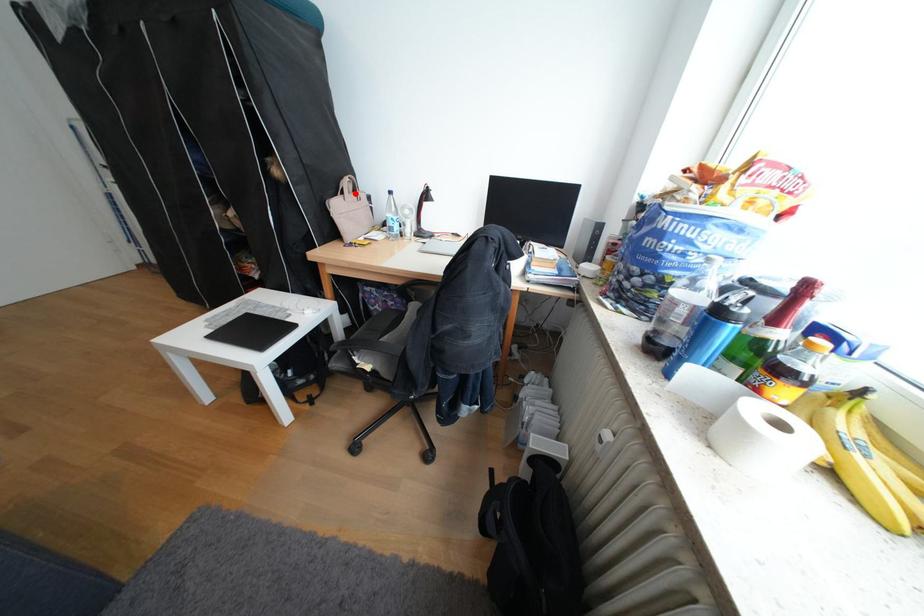
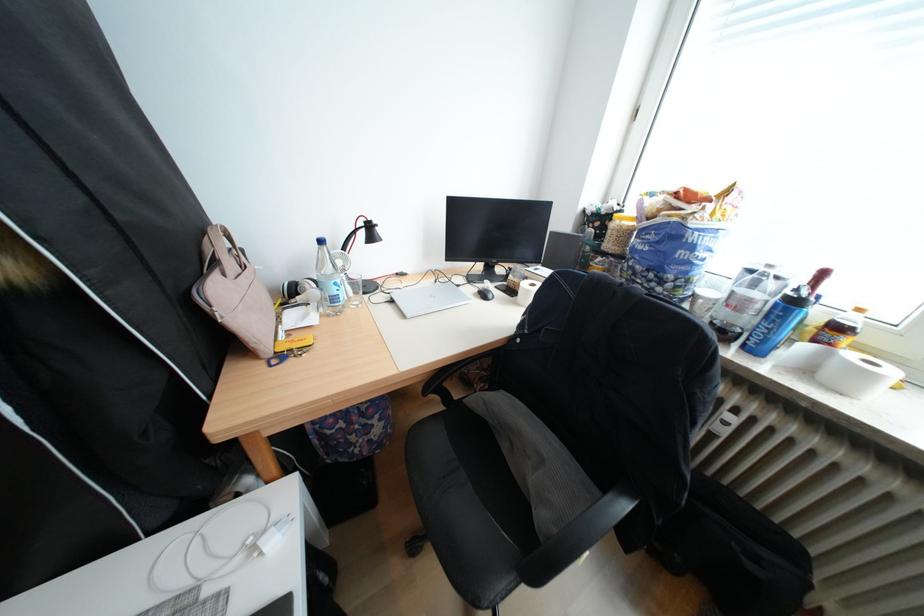
Question: I am providing you with two images of the same scene from different viewpoints. Given a red point in image1, look at the same physical point in image2. Is it:

Choices:
 (A) Closer to the viewpoint
 (B) Farther from the viewpoint

Answer: (B)